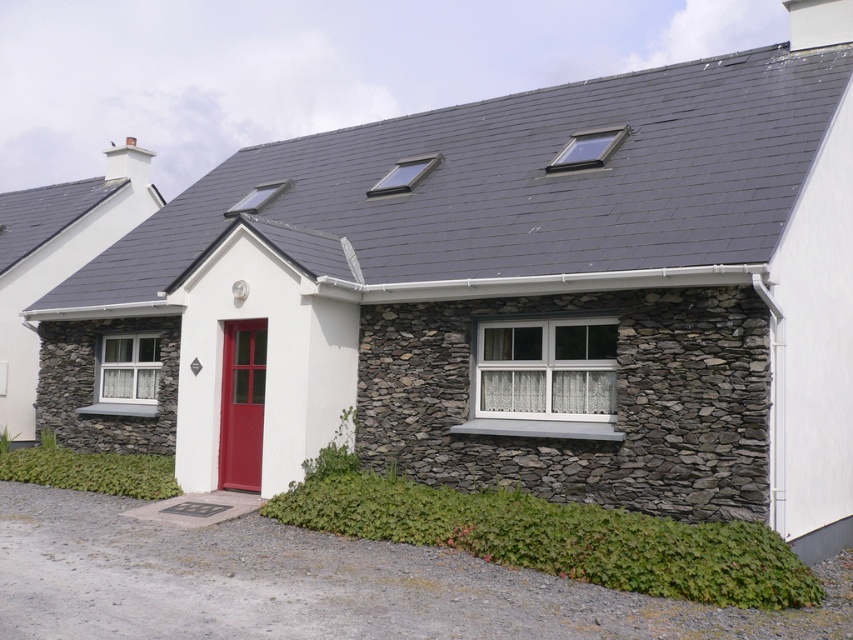
From the picture: You are a delivery person approaching the house and need to park your van on the gray gravel driveway at lower left. To access the matte red door at center, will you have to walk uphill or downhill from the driveway to the door?

The gray gravel driveway at lower left is below matte red door at center, so you will have to walk uphill from the driveway to the door.

You are standing in front of the two story residential building and want to know if the point at coordinate point (22, 301) is closer to you than the point at coordinate point (248, 348). Can you determine this based on the building structure?

Yes, the point at coordinate point (22, 301) is closer to you than the point at coordinate point (248, 348) because it is further to the camera according to the description.

You are a delivery person approaching the house and need to park your vehicle. The gray gravel driveway at lower left is narrow. Will you be able to park your car there if your car requires a space larger than the matte red door at center?

The gray gravel driveway at lower left occupies less space than the matte red door at center, so the driveway is smaller than the required space. Therefore, you cannot park your car there.